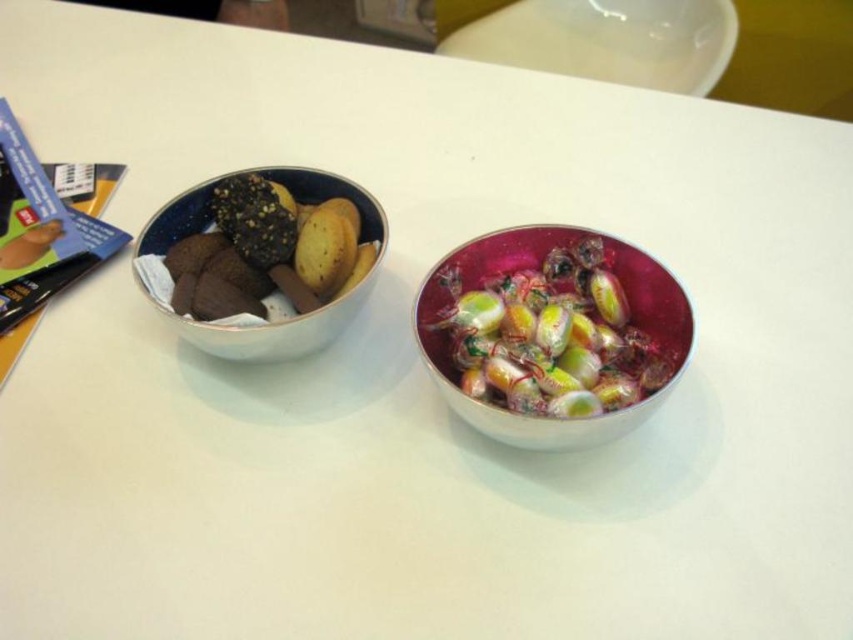
Question: Is shiny metallic bowl at center positioned behind matte ceramic bowl at left?

Choices:
 (A) no
 (B) yes

Answer: (A)

Question: Can you confirm if shiny metallic bowl at center is positioned above matte ceramic bowl at left?

Choices:
 (A) yes
 (B) no

Answer: (B)

Question: Is shiny metallic bowl at center positioned in front of matte ceramic bowl at left?

Choices:
 (A) yes
 (B) no

Answer: (A)

Question: Which point is farther to the camera?

Choices:
 (A) shiny metallic bowl at center
 (B) matte ceramic bowl at left

Answer: (B)

Question: Which point is farther to the camera?

Choices:
 (A) matte ceramic bowl at left
 (B) shiny metallic bowl at center

Answer: (A)

Question: Among these objects, which one is nearest to the camera?

Choices:
 (A) matte ceramic bowl at left
 (B) shiny metallic bowl at center

Answer: (B)